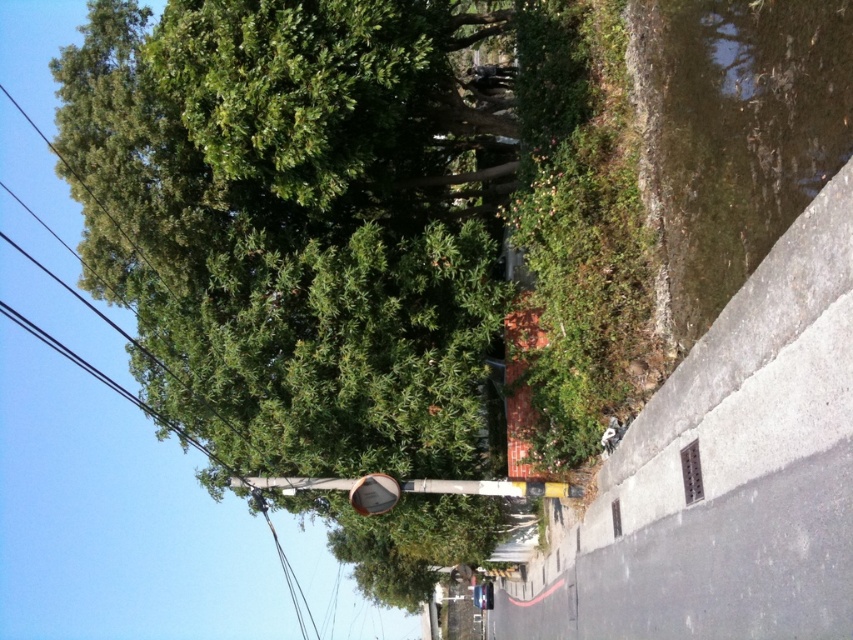
You are a photographer trying to capture the metallic pole at center and the green leafy tree at upper left in your shot. Which object appears wider in the frame?

The green leafy tree at upper left appears wider than the metallic pole at center because its width surpasses the pole.

You are a photographer trying to capture the metallic pole at center and the green leafy tree at upper left in your shot. Based on their sizes in the image, which one would appear larger in your photo?

The green leafy tree at upper left appears larger in the photo than the metallic pole at center because it is bigger.

You are standing on the sidewalk near the drainage grate and want to walk to the traffic sign pole. There are two points marked on your path. Which point, point 1 at coordinates (x=415, y=42) or point 2 at coordinates (x=263, y=476), is closer to you as you start walking towards the traffic sign pole?

Point 1 at coordinates (x=415, y=42) is closer to you than point 2 at coordinates (x=263, y=476) as you start walking towards the traffic sign pole.